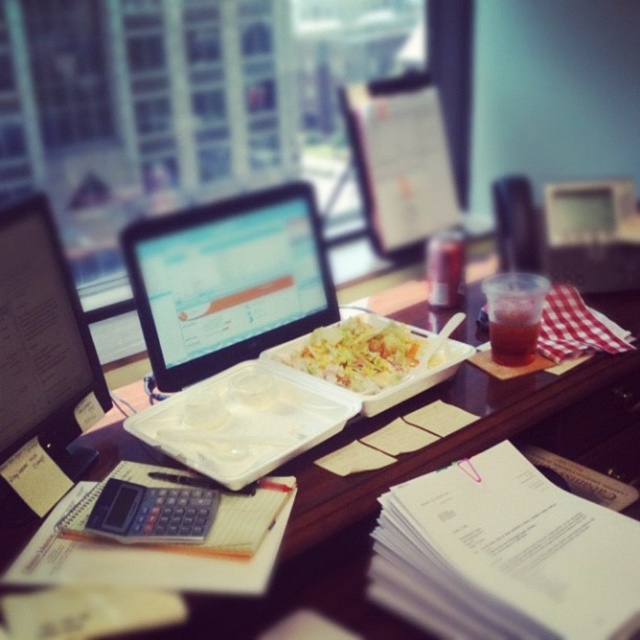
You need to place a new laptop that is 12 inches wide on the wooden table at center or the matte black monitor at center. Based on their sizes, which object can fit the laptop better?

The wooden table at center has a larger width than the matte black monitor at center, so the laptop will fit better on the wooden table at center.